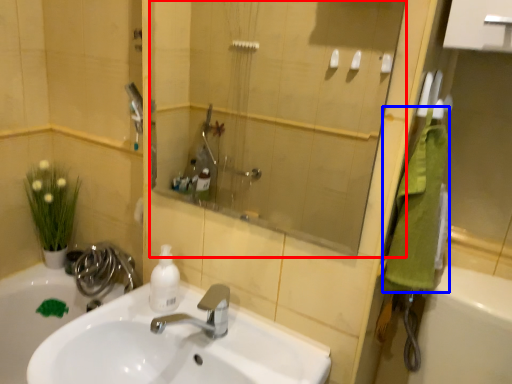
Question: Among these objects, which one is farthest to the camera, mirror (highlighted by a red box) or bath towel (highlighted by a blue box)?

Choices:
 (A) mirror
 (B) bath towel

Answer: (B)